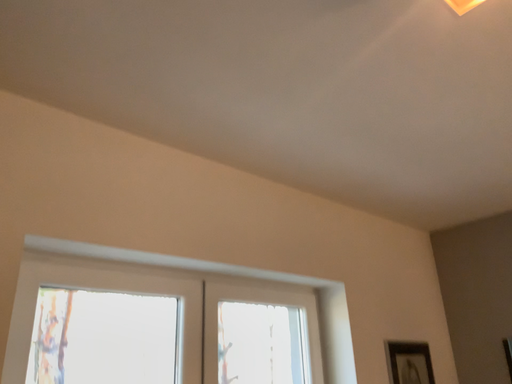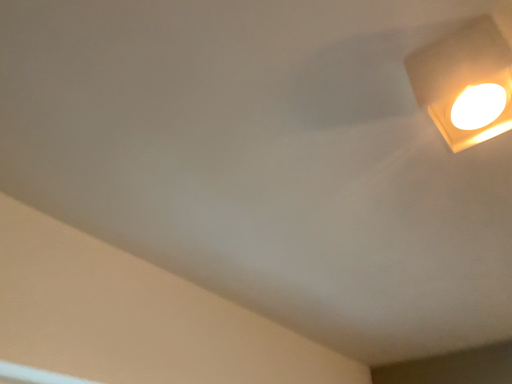
Question: How did the camera likely rotate when shooting the video?

Choices:
 (A) rotated downward
 (B) rotated upward

Answer: (B)